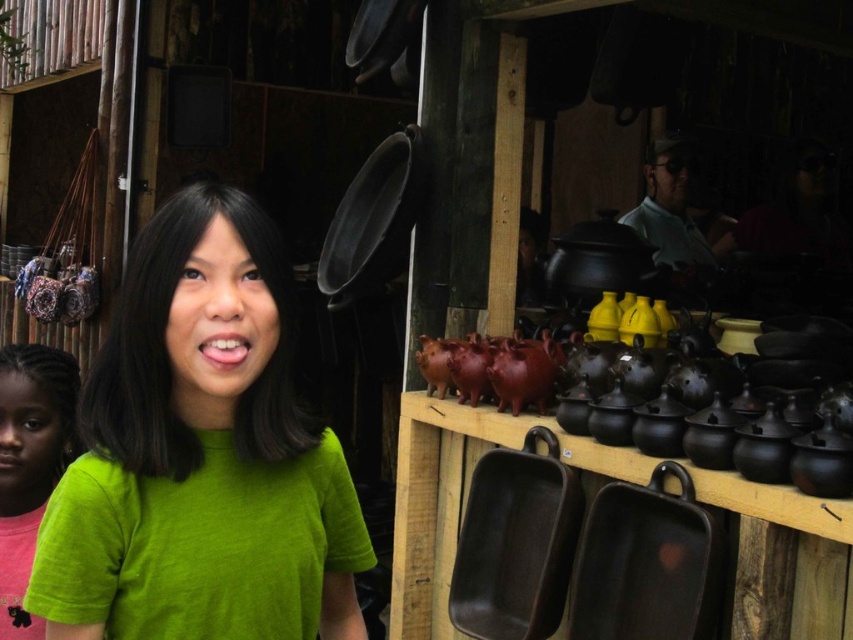
You are a tailor who needs to measure the distance between two green shirts in the market. The shirts are the green fabric shirt at center and the green matte shirt at left. Can you fit a 1 meter long measuring tape between them without it overlapping either shirt?

The distance between the green fabric shirt at center and the green matte shirt at left is 1.01 meters. Since the measuring tape is 1 meter long, it can fit between them without overlapping either shirt as there is an extra 1 centimeter of space.

You are a photographer trying to capture both the green fabric shirt at center and the green matte shirt at left in a single frame. Which shirt will appear smaller in the photo?

The green fabric shirt at center occupies less space than the green matte shirt at left, so it will appear smaller in the photo.

You are a photographer trying to capture the best shot of the two green shirts in the scene. The green fabric shirt at center and the green matte shirt at left are both in your viewfinder. Based on their sizes, which one would you focus on to ensure it appears larger in the photo?

The green fabric shirt at center has a greater height compared to the green matte shirt at left, so focusing on the green fabric shirt at center would make it appear larger in the photo.